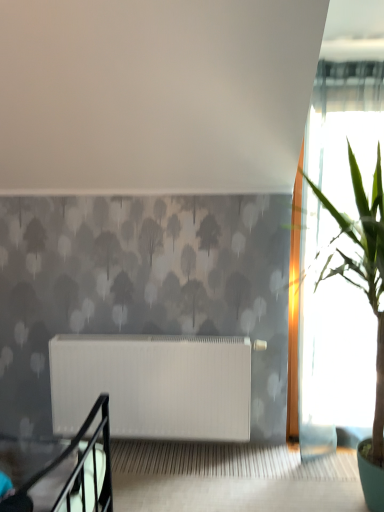
Question: Considering the relative sizes of green leafy plant at right and white matte radiator at center in the image provided, is green leafy plant at right shorter than white matte radiator at center?

Choices:
 (A) no
 (B) yes

Answer: (A)

Question: Is green leafy plant at right completely or partially outside of white matte radiator at center?

Choices:
 (A) no
 (B) yes

Answer: (B)

Question: Is white matte radiator at center a part of green leafy plant at right?

Choices:
 (A) yes
 (B) no

Answer: (B)

Question: Considering the relative positions of green leafy plant at right and white matte radiator at center in the image provided, is green leafy plant at right to the right of white matte radiator at center from the viewer's perspective?

Choices:
 (A) no
 (B) yes

Answer: (B)

Question: Considering the relative sizes of green leafy plant at right and white matte radiator at center in the image provided, is green leafy plant at right smaller than white matte radiator at center?

Choices:
 (A) no
 (B) yes

Answer: (A)

Question: Is green leafy plant at right in front of white matte radiator at center?

Choices:
 (A) no
 (B) yes

Answer: (B)

Question: Considering the relative sizes of white matte radiator at center and green leafy plant at right in the image provided, is white matte radiator at center taller than green leafy plant at right?

Choices:
 (A) yes
 (B) no

Answer: (B)

Question: Is white matte radiator at center not inside green leafy plant at right?

Choices:
 (A) no
 (B) yes

Answer: (B)

Question: From a real-world perspective, is white matte radiator at center on green leafy plant at right?

Choices:
 (A) no
 (B) yes

Answer: (A)

Question: Can green leafy plant at right be found inside white matte radiator at center?

Choices:
 (A) yes
 (B) no

Answer: (B)

Question: Is white matte radiator at center positioned far away from green leafy plant at right?

Choices:
 (A) yes
 (B) no

Answer: (B)

Question: Is white matte radiator at center further to the viewer compared to green leafy plant at right?

Choices:
 (A) no
 (B) yes

Answer: (B)

Question: In terms of height, does white matte radiator at center look taller or shorter compared to green leafy plant at right?

Choices:
 (A) short
 (B) tall

Answer: (A)